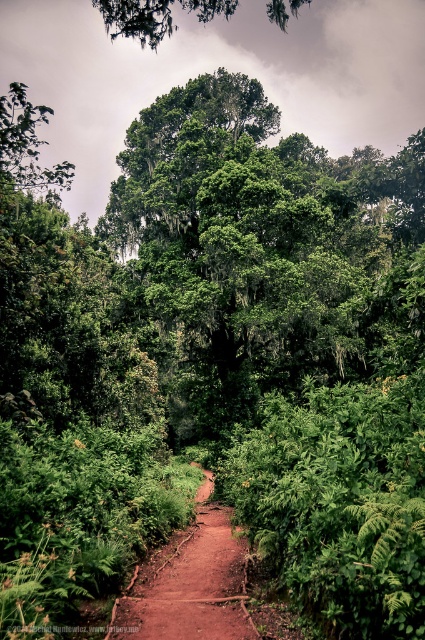
Question: Is brown dirt track at center wider than green leafy tree at upper center?

Choices:
 (A) no
 (B) yes

Answer: (A)

Question: Which object appears closest to the camera in this image?

Choices:
 (A) green leafy tree at upper center
 (B) brown dirt track at center

Answer: (B)

Question: Which point is closer to the camera?

Choices:
 (A) (175, 26)
 (B) (217, 620)

Answer: (B)

Question: Can you confirm if brown dirt track at center is bigger than green leafy tree at upper center?

Choices:
 (A) yes
 (B) no

Answer: (B)

Question: Is brown dirt track at center to the right of green leafy tree at upper center from the viewer's perspective?

Choices:
 (A) yes
 (B) no

Answer: (A)